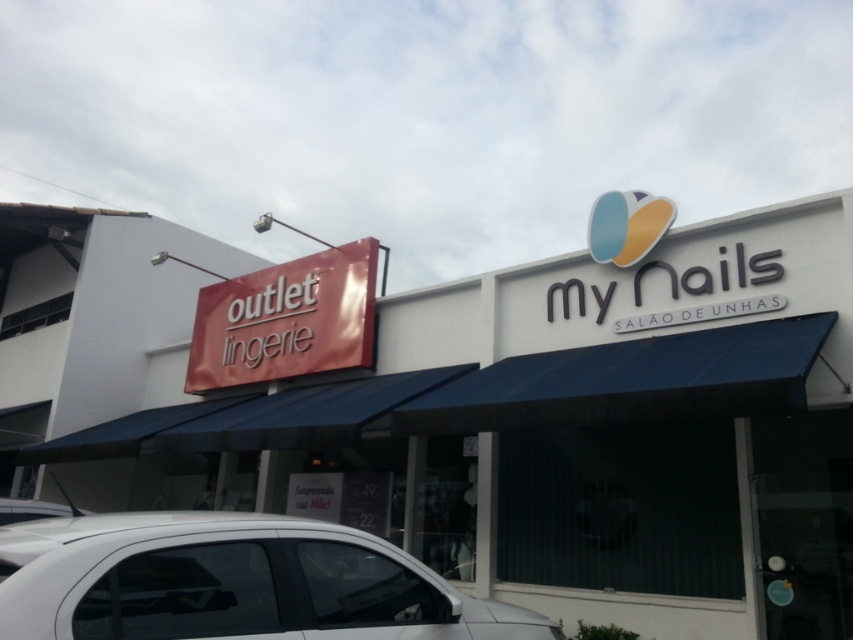
Question: Among these points, which one is farthest from the camera?

Choices:
 (A) 4,504
 (B) 460,337

Answer: (B)

Question: Among these objects, which one is nearest to the camera?

Choices:
 (A) white glossy car at lower left
 (B) white matte sign at upper center

Answer: (B)

Question: Which point appears farthest from the camera in this image?

Choices:
 (A) (778, 499)
 (B) (351, 563)
 (C) (350, 275)
 (D) (22, 512)

Answer: (C)

Question: Is white matte sign at upper center wider than white matte car at lower left?

Choices:
 (A) yes
 (B) no

Answer: (A)

Question: In this image, where is white matte sign at upper center located relative to white glossy car at lower left?

Choices:
 (A) left
 (B) right

Answer: (A)

Question: From the image, what is the correct spatial relationship of white matte sign at upper center in relation to matte red sign at upper left?

Choices:
 (A) right
 (B) left

Answer: (B)